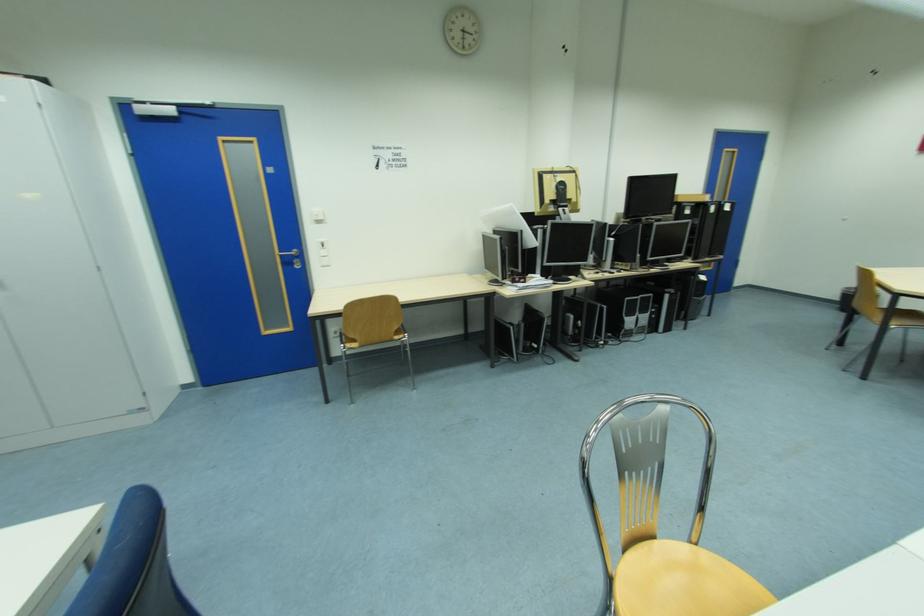
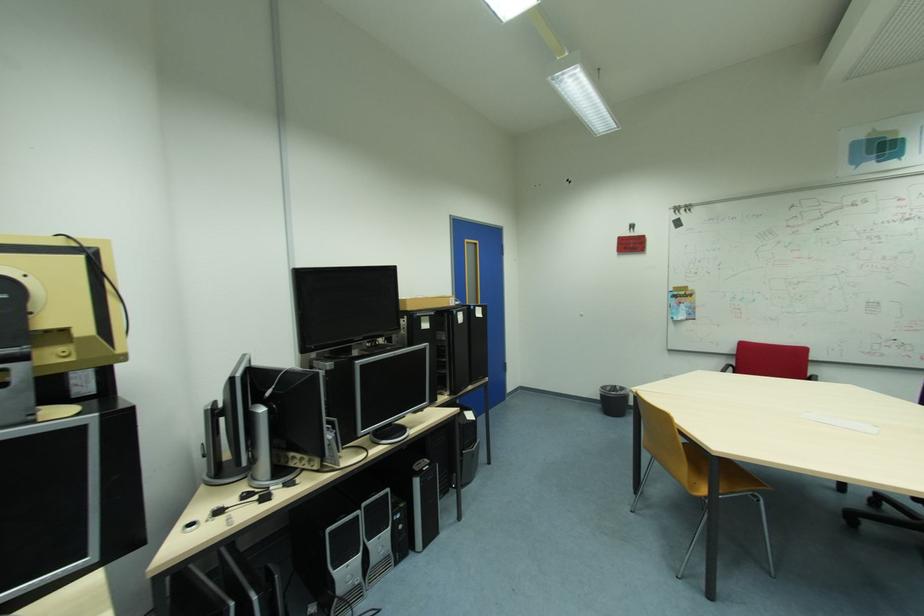
In the second image, find the point that corresponds to the point at 845,300 in the first image.

(605, 400)